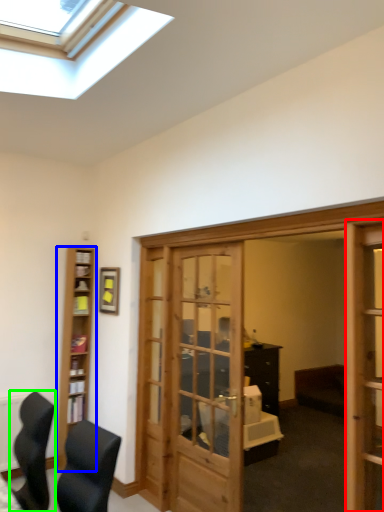
Question: Estimate the real-world distances between objects in this image. Which object is closer to screen door (highlighted by a red box), cabinetry (highlighted by a blue box) or chair (highlighted by a green box)?

Choices:
 (A) cabinetry
 (B) chair

Answer: (B)